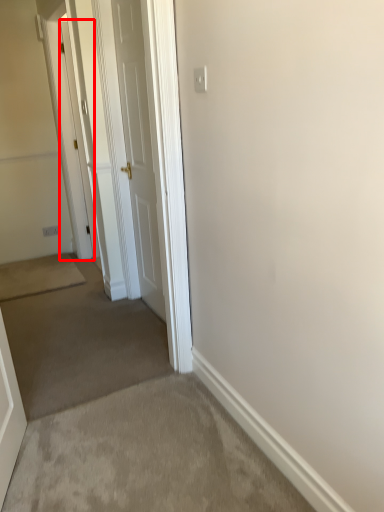
Question: In this image, where is door (annotated by the red box) located relative to door?

Choices:
 (A) right
 (B) left

Answer: (B)